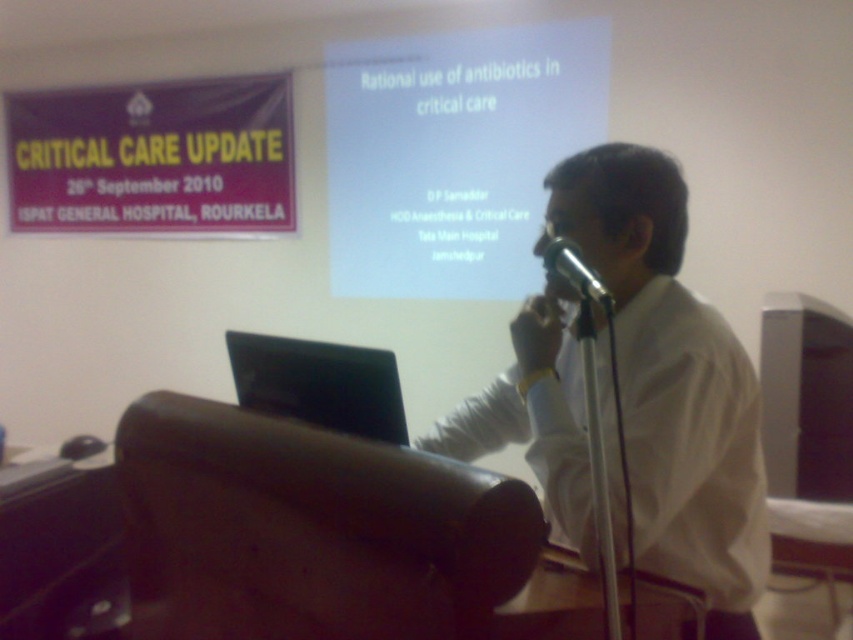
Is the position of white shirt at center less distant than that of white matte projector screen at upper center?

Yes, it is.

Between white shirt at center and white matte projector screen at upper center, which one is positioned higher?

Positioned higher is white matte projector screen at upper center.

Which is behind, point (569, 513) or point (413, 134)?

Positioned behind is point (413, 134).

Where is `white shirt at center`? The width and height of the screenshot is (853, 640). white shirt at center is located at coordinates tap(672, 384).

Is white shirt at center above purple fabric banner at upper left?

Actually, white shirt at center is below purple fabric banner at upper left.

Describe the element at coordinates (672, 384) in the screenshot. I see `white shirt at center` at that location.

Find the location of a particular element. The image size is (853, 640). white shirt at center is located at coordinates (672, 384).

Looking at this image, how distant is white shirt at center from black matte laptop at center?

A distance of 38.83 centimeters exists between white shirt at center and black matte laptop at center.

Is point (531, 458) positioned after point (386, 372)?

Yes, point (531, 458) is farther from viewer.

Find the location of `white shirt at center`. white shirt at center is located at coordinates (672, 384).